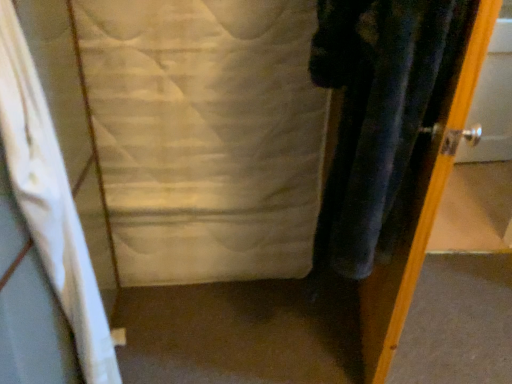
I want to click on free location in front of white quilted fabric at center, so click(x=209, y=327).